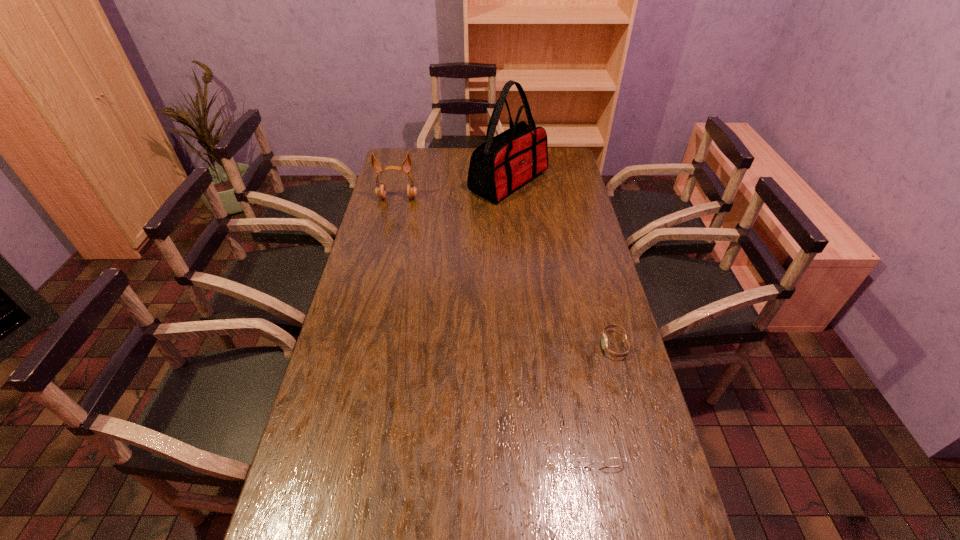
The image size is (960, 540). In order to click on vacant space located on the face of the second nearest object in this screenshot , I will do `click(512, 345)`.

Identify the location of vacant space situated 0.100m on the face of the second nearest object. The image size is (960, 540). (567, 345).

Locate an element on the screen. object that is at the far edge is located at coordinates (502, 164).

Where is `object that is at the left edge`? This screenshot has width=960, height=540. object that is at the left edge is located at coordinates (380, 191).

You are a GUI agent. You are given a task and a screenshot of the screen. Output one action in this format:
    pyautogui.click(x=<x>, y=<y>)
    Task: Click on the duffel bag at the right edge
    This screenshot has height=540, width=960.
    Given the screenshot: What is the action you would take?
    pyautogui.click(x=502, y=164)

The width and height of the screenshot is (960, 540). I want to click on spectacles located in the right edge section of the desktop, so click(582, 461).

This screenshot has height=540, width=960. I want to click on watch present at the right edge, so 604,342.

Where is `object at the far right corner`? The image size is (960, 540). object at the far right corner is located at coordinates 502,164.

The height and width of the screenshot is (540, 960). In the image, there is a desktop. In order to click on free space at the left edge in this screenshot , I will do `click(373, 321)`.

Locate an element on the screen. The height and width of the screenshot is (540, 960). vacant space at the right edge is located at coordinates (613, 368).